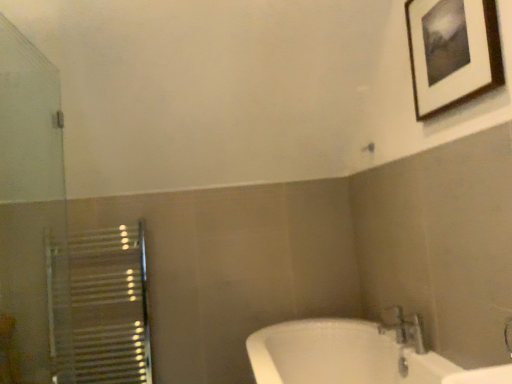
Locate an element on the screen. This screenshot has height=384, width=512. wooden-framed picture at upper right is located at coordinates (452, 52).

Could you tell me if metallic silver faucet at lower right is facing transparent glass screen door at left?

No, metallic silver faucet at lower right is not aimed at transparent glass screen door at left.

Who is more distant, metallic silver faucet at lower right or transparent glass screen door at left?

metallic silver faucet at lower right is behind.

In terms of size, does metallic silver faucet at lower right appear bigger or smaller than transparent glass screen door at left?

Clearly, metallic silver faucet at lower right is smaller in size than transparent glass screen door at left.

Locate an element on the screen. The image size is (512, 384). screen door located above the metallic silver faucet at lower right (from the image's perspective) is located at coordinates (28, 200).

I want to click on picture frame lying above the transparent glass screen door at left (from the image's perspective), so click(x=452, y=52).

From a real-world perspective, is wooden-framed picture at upper right located beneath transparent glass screen door at left?

No, from a real-world perspective, wooden-framed picture at upper right is not below transparent glass screen door at left.

Is wooden-framed picture at upper right closer to the viewer compared to transparent glass screen door at left?

No, it is not.

Is metallic silver faucet at lower right far away from wooden-framed picture at upper right?

metallic silver faucet at lower right is far away from wooden-framed picture at upper right.

Identify the location of picture frame that is in front of the metallic silver faucet at lower right. This screenshot has height=384, width=512. (452, 52).

From the image's perspective, between metallic silver faucet at lower right and wooden-framed picture at upper right, which one is located above?

wooden-framed picture at upper right.

Between metallic silver faucet at lower right and wooden-framed picture at upper right, which one has larger width?

With larger width is metallic silver faucet at lower right.

Which is closer to the camera, (456, 74) or (420, 333)?

Clearly, point (456, 74) is closer to the camera than point (420, 333).

Is wooden-framed picture at upper right wider or thinner than metallic silver faucet at lower right?

Considering their sizes, wooden-framed picture at upper right looks slimmer than metallic silver faucet at lower right.

Is the position of wooden-framed picture at upper right more distant than that of metallic silver faucet at lower right?

No, wooden-framed picture at upper right is closer to the viewer.

Which of these two, transparent glass screen door at left or wooden-framed picture at upper right, is wider?

transparent glass screen door at left.

Is transparent glass screen door at left further to the viewer compared to wooden-framed picture at upper right?

That is False.

Does transparent glass screen door at left have a greater height compared to wooden-framed picture at upper right?

Yes.

Considering the relative sizes of transparent glass screen door at left and metallic silver faucet at lower right in the image provided, is transparent glass screen door at left smaller than metallic silver faucet at lower right?

No.

You are a GUI agent. You are given a task and a screenshot of the screen. Output one action in this format:
    pyautogui.click(x=<x>, y=<y>)
    Task: Click on the tap to the right of transparent glass screen door at left
    
    Given the screenshot: What is the action you would take?
    tap(403, 328)

From a real-world perspective, is transparent glass screen door at left beneath metallic silver faucet at lower right?

Actually, transparent glass screen door at left is physically above metallic silver faucet at lower right in the real world.

Where is `screen door above the metallic silver faucet at lower right (from the image's perspective)`? The image size is (512, 384). screen door above the metallic silver faucet at lower right (from the image's perspective) is located at coordinates (28, 200).

There is a transparent glass screen door at left. Identify the location of picture frame above it (from a real-world perspective). (452, 52).

Based on their spatial positions, is transparent glass screen door at left or metallic silver faucet at lower right further from wooden-framed picture at upper right?

transparent glass screen door at left is positioned further to the anchor wooden-framed picture at upper right.

Considering their positions, is wooden-framed picture at upper right positioned further to metallic silver faucet at lower right than transparent glass screen door at left?

transparent glass screen door at left lies further to metallic silver faucet at lower right than the other object.

Estimate the real-world distances between objects in this image. Which object is closer to transparent glass screen door at left, metallic silver faucet at lower right or wooden-framed picture at upper right?

wooden-framed picture at upper right lies closer to transparent glass screen door at left than the other object.

Looking at the image, which one is located further to metallic silver faucet at lower right, transparent glass screen door at left or wooden-framed picture at upper right?

transparent glass screen door at left is further to metallic silver faucet at lower right.

Estimate the real-world distances between objects in this image. Which object is closer to transparent glass screen door at left, wooden-framed picture at upper right or metallic silver faucet at lower right?

wooden-framed picture at upper right.

Based on their spatial positions, is metallic silver faucet at lower right or transparent glass screen door at left closer to wooden-framed picture at upper right?

metallic silver faucet at lower right lies closer to wooden-framed picture at upper right than the other object.

The image size is (512, 384). Find the location of `tap between transparent glass screen door at left and wooden-framed picture at upper right in the horizontal direction`. tap between transparent glass screen door at left and wooden-framed picture at upper right in the horizontal direction is located at coordinates (403, 328).